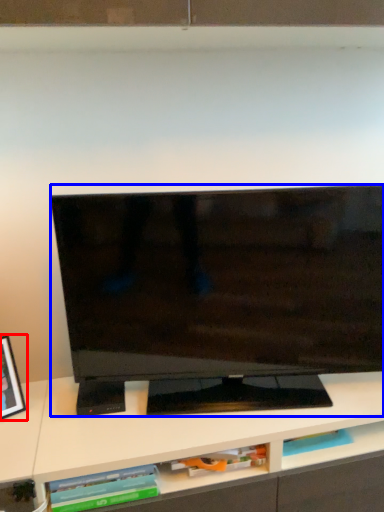
Question: Among these objects, which one is nearest to the camera, picture frame (highlighted by a red box) or television (highlighted by a blue box)?

Choices:
 (A) picture frame
 (B) television

Answer: (A)